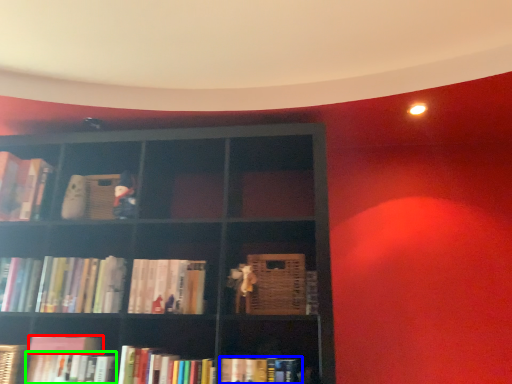
Question: Which is farther away from book (highlighted by a red box)? book (highlighted by a blue box) or book (highlighted by a green box)?

Choices:
 (A) book
 (B) book

Answer: (A)